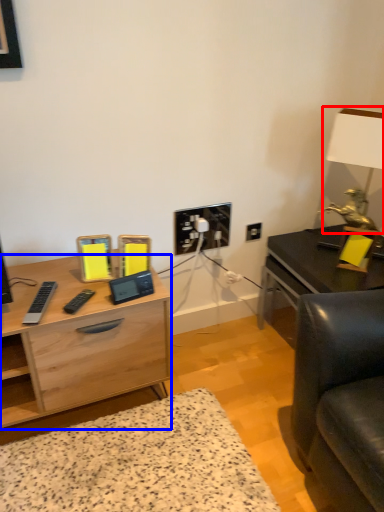
Question: Which of the following is the farthest to the observer, table lamp (highlighted by a red box) or desk (highlighted by a blue box)?

Choices:
 (A) table lamp
 (B) desk

Answer: (A)